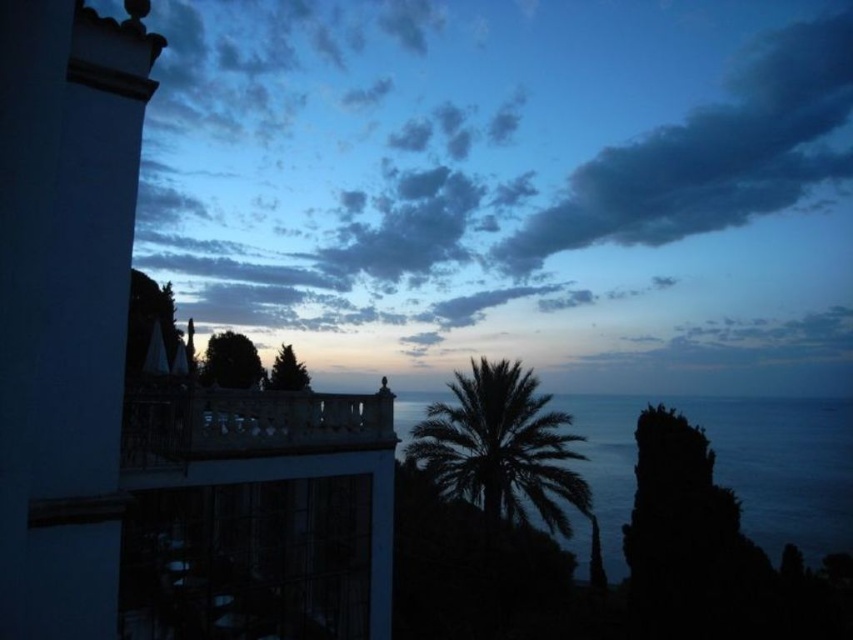
Question: Which point is farther to the camera?

Choices:
 (A) (764, 100)
 (B) (729, 474)
 (C) (463, 493)

Answer: (A)

Question: Can you confirm if white stone balcony at upper left is positioned above dark gray cloud at upper right?

Choices:
 (A) yes
 (B) no

Answer: (B)

Question: Estimate the real-world distances between objects in this image. Which object is farther from the dark blue cloud at upper center?

Choices:
 (A) green leafy palm tree at center
 (B) white stone balcony at center

Answer: (B)

Question: Is green leafy palm tree at center positioned before white stone balcony at center?

Choices:
 (A) no
 (B) yes

Answer: (A)

Question: Which point is closer to the camera?

Choices:
 (A) dark blue water at center
 (B) white stone balcony at center

Answer: (B)

Question: Does dark blue water at center lie in front of white stone balcony at center?

Choices:
 (A) yes
 (B) no

Answer: (B)